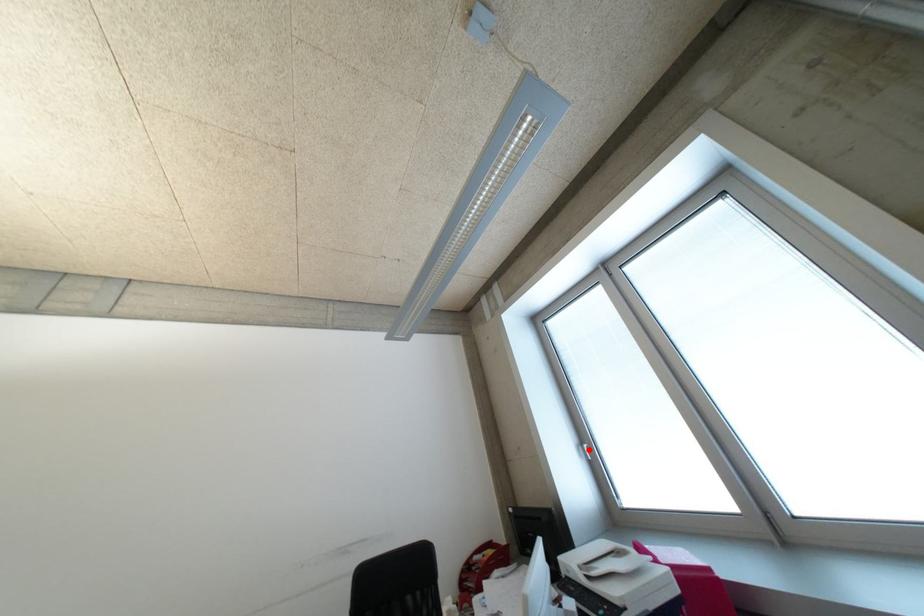
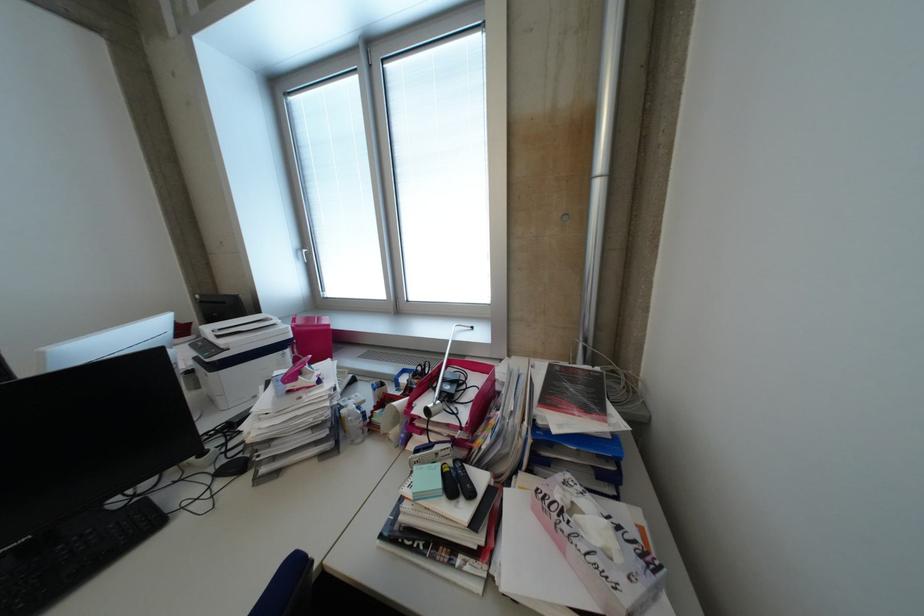
Question: I am providing you with two images of the same scene from different viewpoints. Given a red point in image1, look at the same physical point in image2. Is it:

Choices:
 (A) Closer to the viewpoint
 (B) Farther from the viewpoint

Answer: (A)